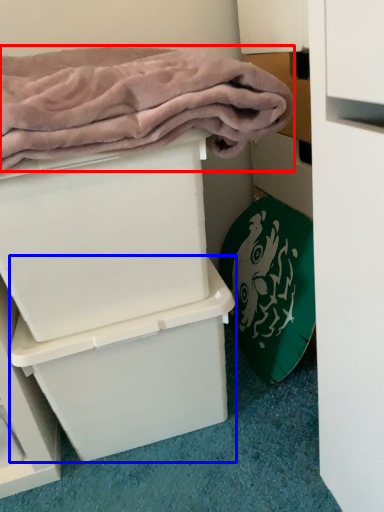
Question: Among these objects, which one is nearest to the camera, bath towel (highlighted by a red box) or box (highlighted by a blue box)?

Choices:
 (A) bath towel
 (B) box

Answer: (A)